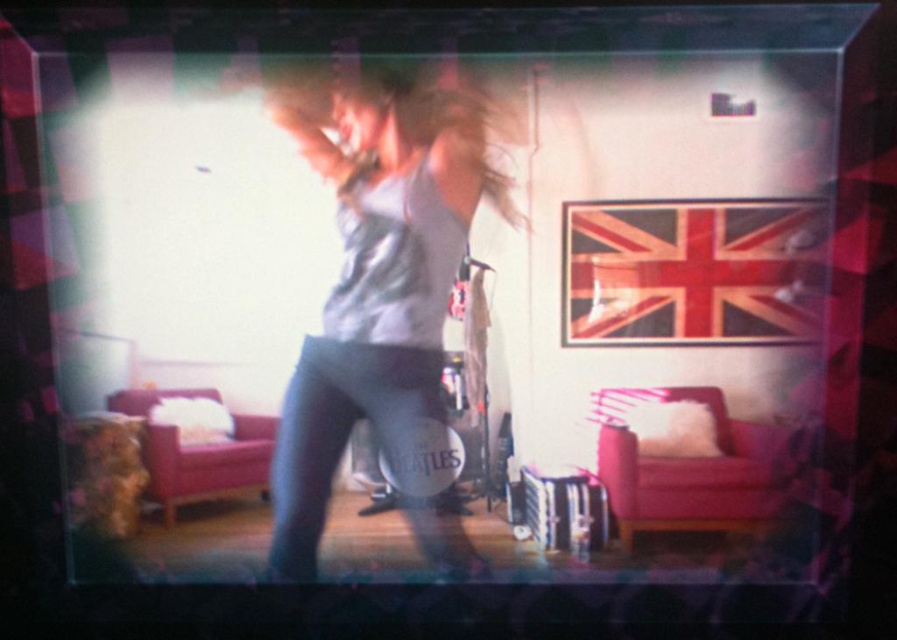
You are designing a costume for a music performance and need to ensure that the gray matte tank top at center will not cover the blonde silky hair at center. Based on the image, is the tank top wider than the hair?

The gray matte tank top at center might be wider than blonde silky hair at center, so there is a possibility that the tank top could cover the hair if not adjusted properly.

You are a virtual assistant in a music game. You need to determine which object at the center is taller between the gray matte tank top at center and the blonde silky hair at center. Which one is taller?

The gray matte tank top at center is much taller than the blonde silky hair at center according to the description.